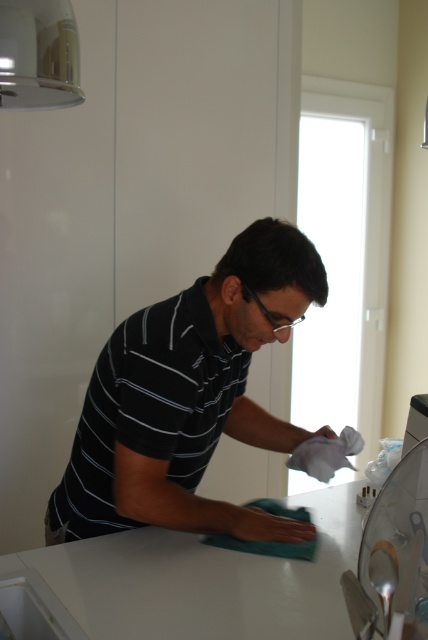
Question: Can you confirm if black striped shirt at center is positioned above white glossy counter top at center?

Choices:
 (A) yes
 (B) no

Answer: (A)

Question: Is black striped shirt at center wider than white glossy counter top at center?

Choices:
 (A) no
 (B) yes

Answer: (A)

Question: Which point is farther from the camera taking this photo?

Choices:
 (A) (204, 621)
 (B) (276, 428)

Answer: (B)

Question: Which object appears closest to the camera in this image?

Choices:
 (A) white glossy counter top at center
 (B) black striped shirt at center

Answer: (A)

Question: From the image, what is the correct spatial relationship of black striped shirt at center in relation to white glossy counter top at center?

Choices:
 (A) below
 (B) above

Answer: (B)